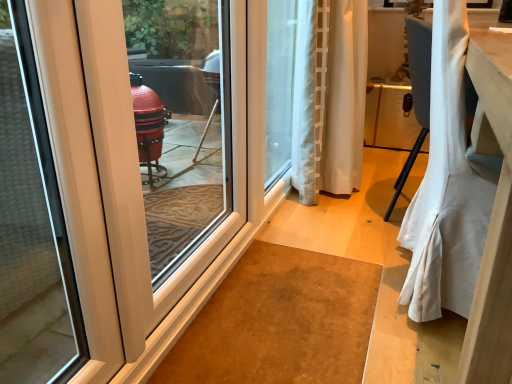
Question: Is white fabric curtain at right, which ranks as the 1th curtain in front-to-back order, shorter than white sheer curtain at center, marked as the first curtain in a back-to-front arrangement?

Choices:
 (A) yes
 (B) no

Answer: (A)

Question: From a real-world perspective, is white fabric curtain at right, which ranks as the 1th curtain in front-to-back order, on top of white sheer curtain at center, marked as the first curtain in a back-to-front arrangement?

Choices:
 (A) no
 (B) yes

Answer: (A)

Question: Considering the relative sizes of white fabric curtain at right, the 2th curtain when ordered from back to front, and white sheer curtain at center, which is counted as the 2th curtain, starting from the front, in the image provided, is white fabric curtain at right, the 2th curtain when ordered from back to front, wider than white sheer curtain at center, which is counted as the 2th curtain, starting from the front,?

Choices:
 (A) yes
 (B) no

Answer: (A)

Question: Does white fabric curtain at right, which ranks as the 1th curtain in front-to-back order, lie behind white sheer curtain at center, marked as the first curtain in a back-to-front arrangement?

Choices:
 (A) yes
 (B) no

Answer: (B)

Question: Is white fabric curtain at right, which ranks as the 1th curtain in front-to-back order, positioned with its back to white sheer curtain at center, which is counted as the 2th curtain, starting from the front?

Choices:
 (A) no
 (B) yes

Answer: (A)

Question: Is white sheer curtain at center, which is counted as the 2th curtain, starting from the front, spatially inside carpet at center, or outside of it?

Choices:
 (A) inside
 (B) outside

Answer: (B)

Question: Looking at the image, does white sheer curtain at center, marked as the first curtain in a back-to-front arrangement, seem bigger or smaller compared to carpet at center?

Choices:
 (A) small
 (B) big

Answer: (B)

Question: From the image's perspective, is white sheer curtain at center, marked as the first curtain in a back-to-front arrangement, located above or below carpet at center?

Choices:
 (A) above
 (B) below

Answer: (A)

Question: From a real-world perspective, is white sheer curtain at center, marked as the first curtain in a back-to-front arrangement, physically located above or below carpet at center?

Choices:
 (A) below
 (B) above

Answer: (B)

Question: Is white fabric curtain at right, which ranks as the 1th curtain in front-to-back order, bigger or smaller than carpet at center?

Choices:
 (A) big
 (B) small

Answer: (A)

Question: Looking at their shapes, would you say white fabric curtain at right, the 2th curtain when ordered from back to front, is wider or thinner than carpet at center?

Choices:
 (A) thin
 (B) wide

Answer: (A)

Question: Is white fabric curtain at right, which ranks as the 1th curtain in front-to-back order, inside or outside of carpet at center?

Choices:
 (A) inside
 (B) outside

Answer: (B)

Question: Considering the positions of white fabric curtain at right, the 2th curtain when ordered from back to front, and carpet at center in the image, is white fabric curtain at right, the 2th curtain when ordered from back to front, taller or shorter than carpet at center?

Choices:
 (A) short
 (B) tall

Answer: (B)

Question: From a real-world perspective, is white sheer curtain at center, which is counted as the 2th curtain, starting from the front, positioned above or below white glossy door at left?

Choices:
 (A) above
 (B) below

Answer: (A)

Question: Is white sheer curtain at center, marked as the first curtain in a back-to-front arrangement, bigger or smaller than white glossy door at left?

Choices:
 (A) small
 (B) big

Answer: (B)